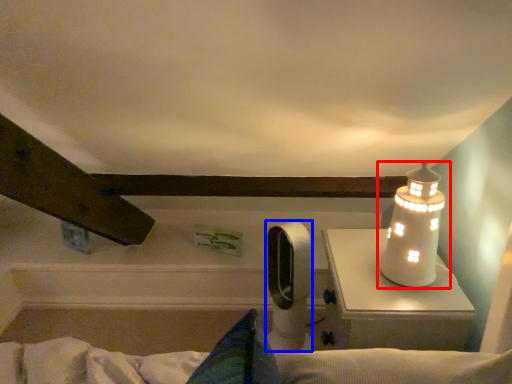
Question: Among these objects, which one is farthest to the camera, lamp (highlighted by a red box) or equipment (highlighted by a blue box)?

Choices:
 (A) lamp
 (B) equipment

Answer: (B)